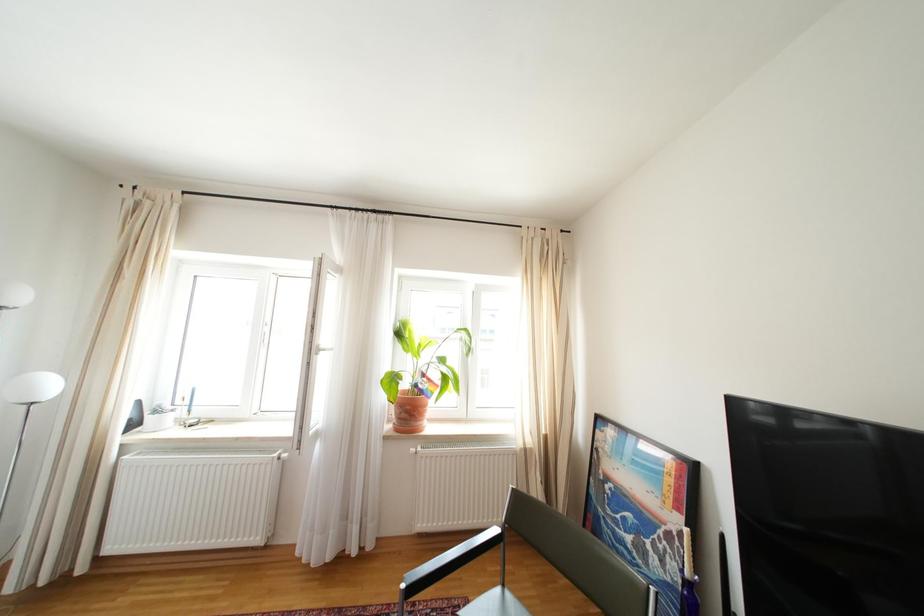
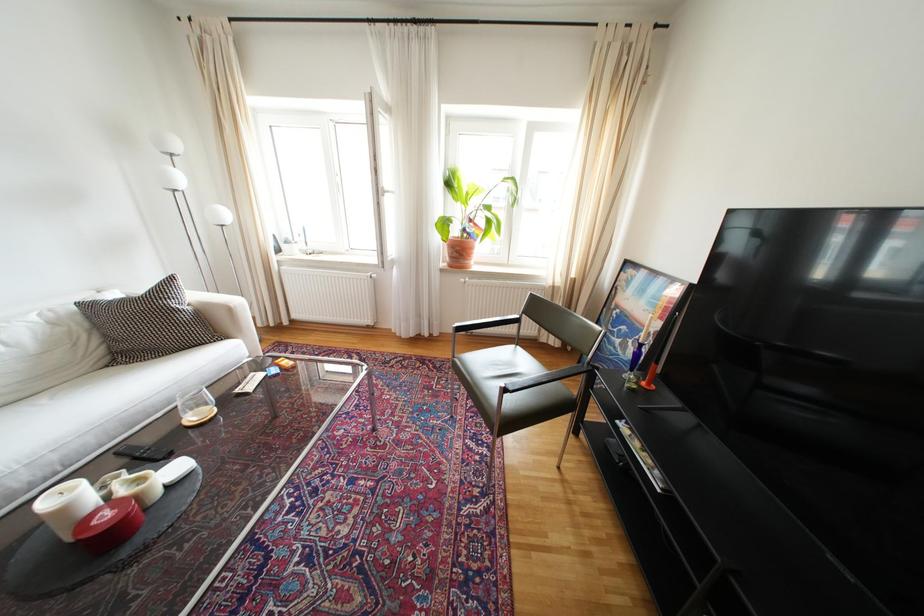
Question: Based on the continuous images, in which direction is the camera rotating? Reply with the corresponding letter.

Choices:
 (A) Left
 (B) Right
 (C) Up
 (D) Down

Answer: (D)